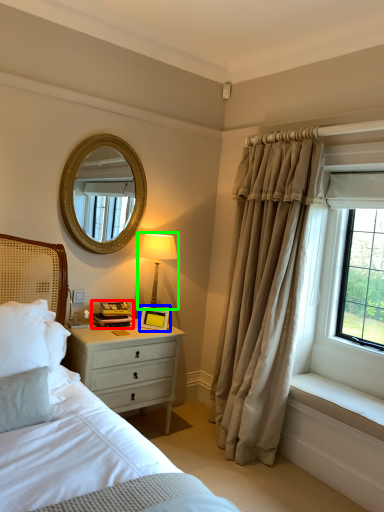
Question: Which is farther away from book (highlighted by a red box)? picture frame (highlighted by a blue box) or bedside lamp (highlighted by a green box)?

Choices:
 (A) picture frame
 (B) bedside lamp

Answer: (B)